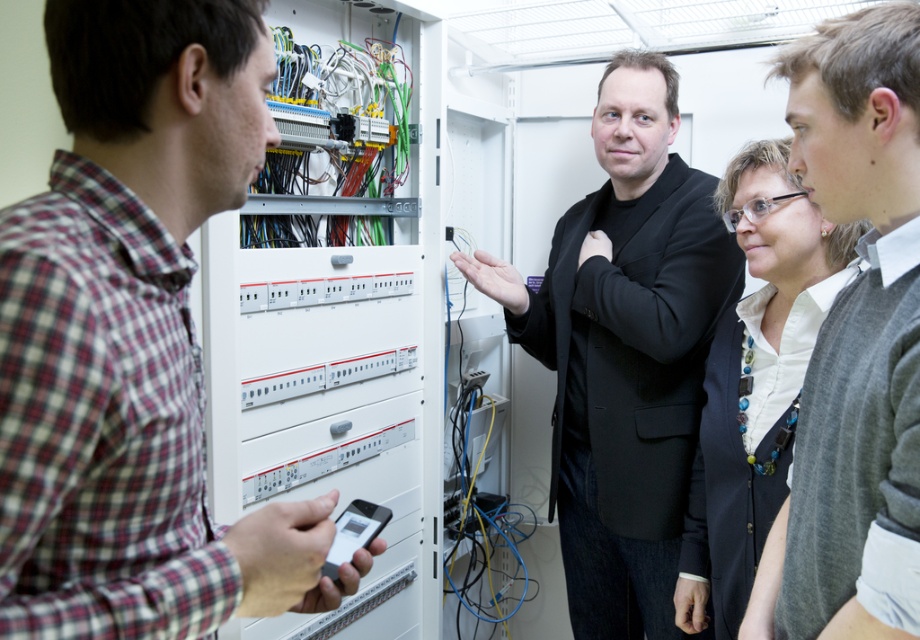
Question: Which point is closer to the camera taking this photo?

Choices:
 (A) (615, 268)
 (B) (914, 275)
 (C) (766, 342)
 (D) (186, 572)

Answer: (D)

Question: Which of the following is the closest to the observer?

Choices:
 (A) (645, 220)
 (B) (141, 182)
 (C) (811, 394)

Answer: (B)

Question: Does plaid cotton shirt at left come behind white glossy shirt at upper center?

Choices:
 (A) yes
 (B) no

Answer: (B)

Question: Observing the image, what is the correct spatial positioning of plaid cotton shirt at left in reference to black matte suit at center?

Choices:
 (A) above
 (B) below

Answer: (A)

Question: Can you confirm if plaid cotton shirt at left is bigger than white glossy shirt at upper center?

Choices:
 (A) yes
 (B) no

Answer: (B)

Question: Which point appears closest to the camera in this image?

Choices:
 (A) (x=881, y=65)
 (B) (x=24, y=589)

Answer: (B)